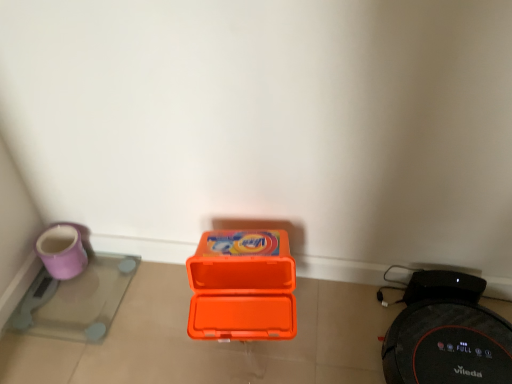
Question: Is black rubber robot vacuum cleaner at lower right, the second appliance in the left-to-right sequence, bigger or smaller than purple glossy scale at lower left, the second appliance when ordered from right to left?

Choices:
 (A) small
 (B) big

Answer: (B)

Question: From the image's perspective, relative to purple glossy scale at lower left, the second appliance when ordered from right to left, is black rubber robot vacuum cleaner at lower right, marked as the 1th appliance in a right-to-left arrangement, above or below?

Choices:
 (A) above
 (B) below

Answer: (B)

Question: Which is farther from the orange plastic box at center?

Choices:
 (A) purple glossy scale at lower left, the first appliance viewed from the left
 (B) black rubber robot vacuum cleaner at lower right, marked as the 1th appliance in a right-to-left arrangement

Answer: (A)

Question: Which object is positioned closest to the black rubber robot vacuum cleaner at lower right, the second appliance in the left-to-right sequence?

Choices:
 (A) orange plastic box at center
 (B) purple glossy scale at lower left, the first appliance viewed from the left

Answer: (A)